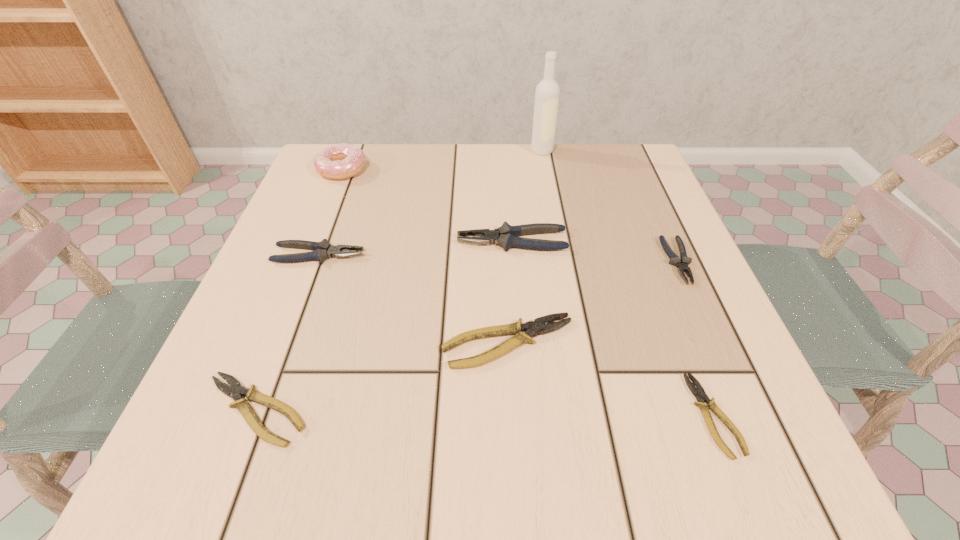
At what (x,y) coordinates should I click in order to perform the action: click on the smallest gray pliers. Please return your answer as a coordinate pair (x, y). This screenshot has width=960, height=540. Looking at the image, I should click on (682, 263).

The height and width of the screenshot is (540, 960). In order to click on the leftmost yellow pliers in this screenshot , I will do `click(234, 391)`.

Where is `the second shortest object`? the second shortest object is located at coordinates (234, 391).

Where is `the rightmost yellow pliers`? The image size is (960, 540). the rightmost yellow pliers is located at coordinates (699, 393).

Where is `the smallest yellow pliers`? Image resolution: width=960 pixels, height=540 pixels. the smallest yellow pliers is located at coordinates (699, 393).

The image size is (960, 540). Identify the location of free spot located 0.190m on the front of the tallest object. (552, 204).

Find the location of a particular element. free space located 0.320m on the front of the doughnut is located at coordinates (295, 290).

Where is `free space located 0.340m at the gripping part of the biggest gray pliers`? This screenshot has height=540, width=960. free space located 0.340m at the gripping part of the biggest gray pliers is located at coordinates (281, 241).

Where is `vacant point located 0.050m at the gripping part of the biggest gray pliers`? Image resolution: width=960 pixels, height=540 pixels. vacant point located 0.050m at the gripping part of the biggest gray pliers is located at coordinates (431, 241).

Find the location of a particular element. The height and width of the screenshot is (540, 960). free spot located at the gripping part of the biggest gray pliers is located at coordinates (353, 241).